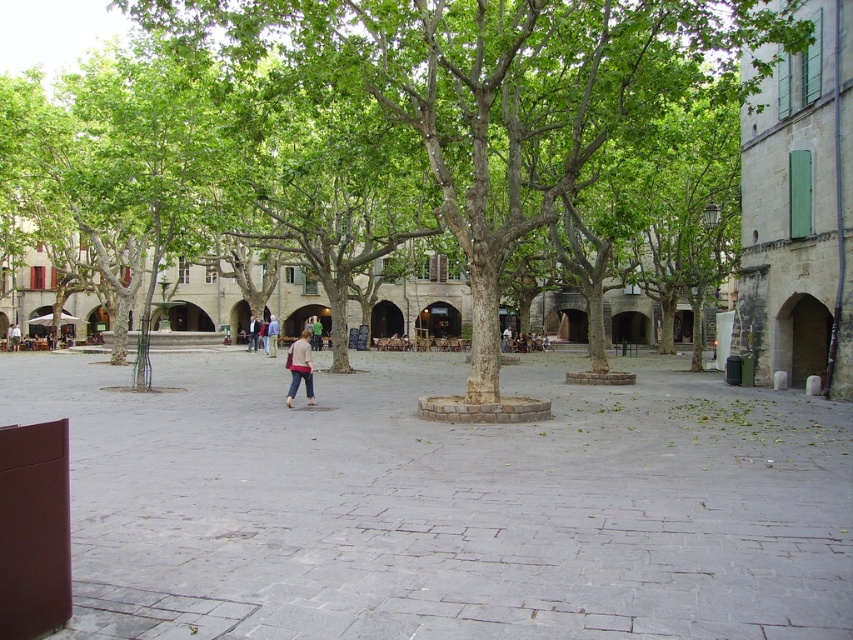
Question: Is gray stone courtyard at lower left below green fabric jacket at center?

Choices:
 (A) no
 (B) yes

Answer: (B)

Question: Which object appears farthest from the camera in this image?

Choices:
 (A) light brown leather jacket at center
 (B) gray stone courtyard at lower left

Answer: (A)

Question: Is pink fabric pants at center to the right of green fabric jacket at center from the viewer's perspective?

Choices:
 (A) yes
 (B) no

Answer: (A)

Question: Based on their relative distances, which object is farther from the green fabric jacket at center?

Choices:
 (A) gray stone courtyard at lower left
 (B) pink fabric pants at center
 (C) light brown leather jacket at center
 (D) denim jacket at center

Answer: (A)

Question: Does denim jacket at center appear over green fabric jacket at center?

Choices:
 (A) yes
 (B) no

Answer: (B)

Question: Among these objects, which one is farthest from the camera?

Choices:
 (A) gray stone courtyard at lower left
 (B) green fabric jacket at center
 (C) denim jacket at center
 (D) pink fabric pants at center

Answer: (B)